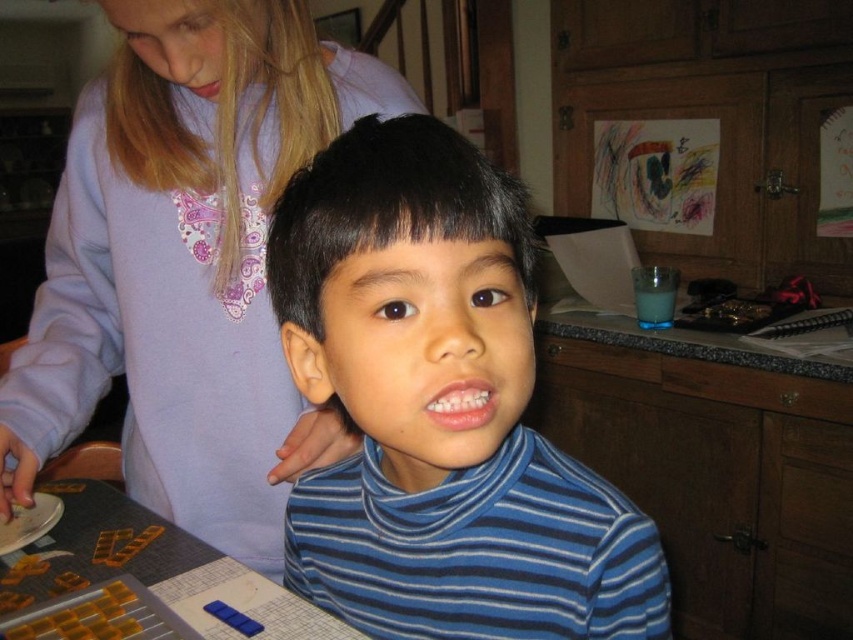
Question: Considering the relative positions of blue striped turtleneck at center and purple soft sweater at upper left in the image provided, where is blue striped turtleneck at center located with respect to purple soft sweater at upper left?

Choices:
 (A) right
 (B) left

Answer: (A)

Question: Which of the following is the closest to the observer?

Choices:
 (A) blue striped turtleneck at center
 (B) matte pink lips at upper center
 (C) purple soft sweater at upper left

Answer: (A)

Question: Is blue striped turtleneck at center below matte pink lips at upper center?

Choices:
 (A) yes
 (B) no

Answer: (A)

Question: Among these objects, which one is farthest from the camera?

Choices:
 (A) blue striped turtleneck at center
 (B) matte pink lips at upper center

Answer: (B)

Question: Estimate the real-world distances between objects in this image. Which object is closer to the blue striped turtleneck at center?

Choices:
 (A) matte pink lips at upper center
 (B) pink glossy lips at center

Answer: (B)

Question: Does blue striped turtleneck at center have a smaller size compared to purple soft sweater at upper left?

Choices:
 (A) yes
 (B) no

Answer: (A)